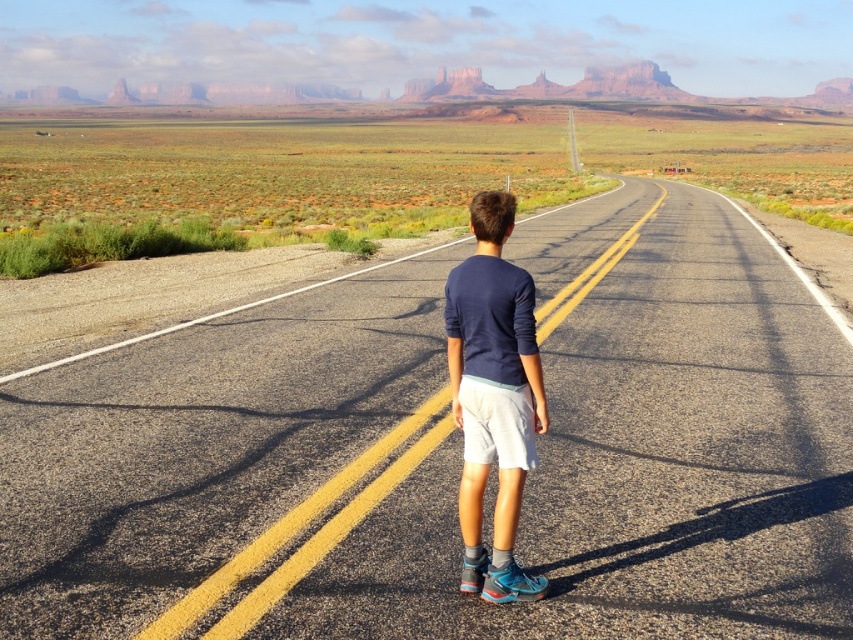
You are a drone operator trying to capture a photo of the asphalt road at center and the navy blue shirt at center. Which object should you focus on first if you want to ensure both are in focus without adjusting the camera settings?

The asphalt road at center is above the navy blue shirt at center, so focusing on the asphalt road at center first will ensure both are in focus since it is closer to the camera.